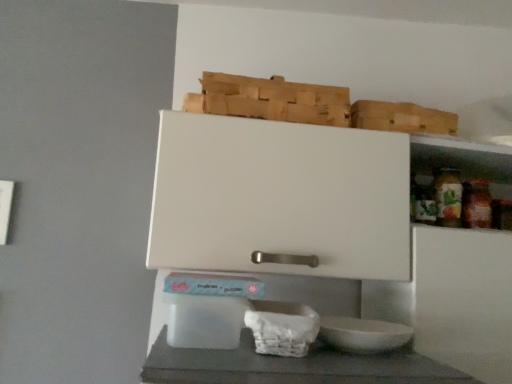
This screenshot has width=512, height=384. I want to click on natural wood blocks at upper center, so click(x=270, y=100).

Describe the element at coordinates (270, 100) in the screenshot. I see `natural wood blocks at upper center` at that location.

This screenshot has width=512, height=384. I want to click on natural wood blocks at upper center, so 270,100.